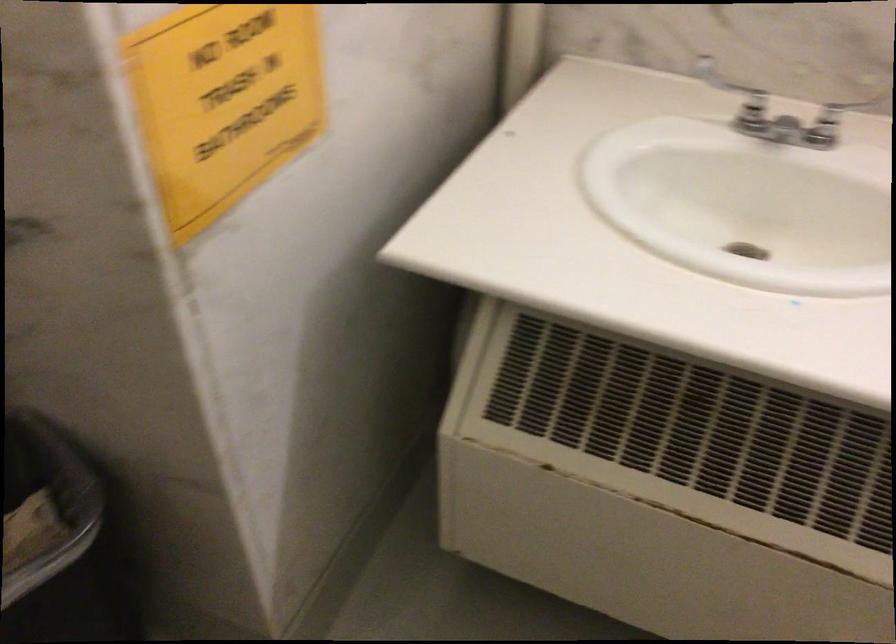
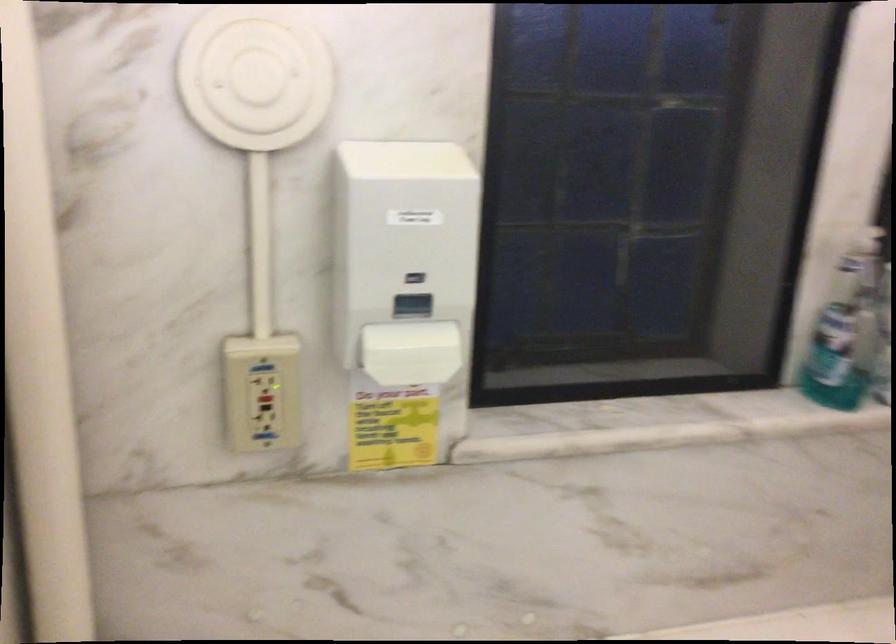
Question: The first image is from the beginning of the video and the second image is from the end. How did the camera likely rotate when shooting the video?

Choices:
 (A) Left
 (B) Right
 (C) Up
 (D) Down

Answer: (B)